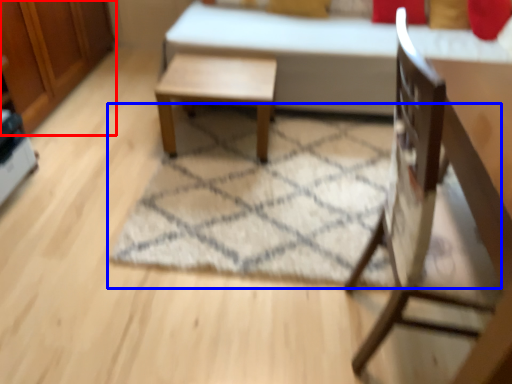
Question: Which point is closer to the camera, dresser (highlighted by a red box) or mat (highlighted by a blue box)?

Choices:
 (A) dresser
 (B) mat

Answer: (B)